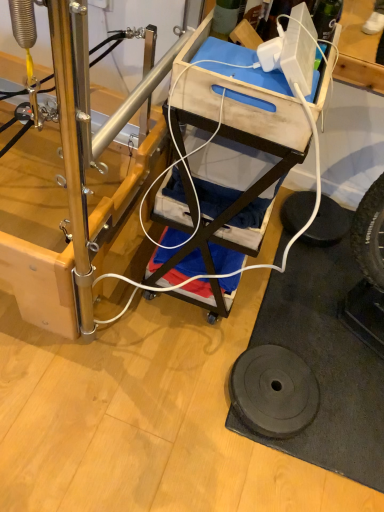
Where is `free space in front of wooden cart at center`? The height and width of the screenshot is (512, 384). free space in front of wooden cart at center is located at coordinates (167, 349).